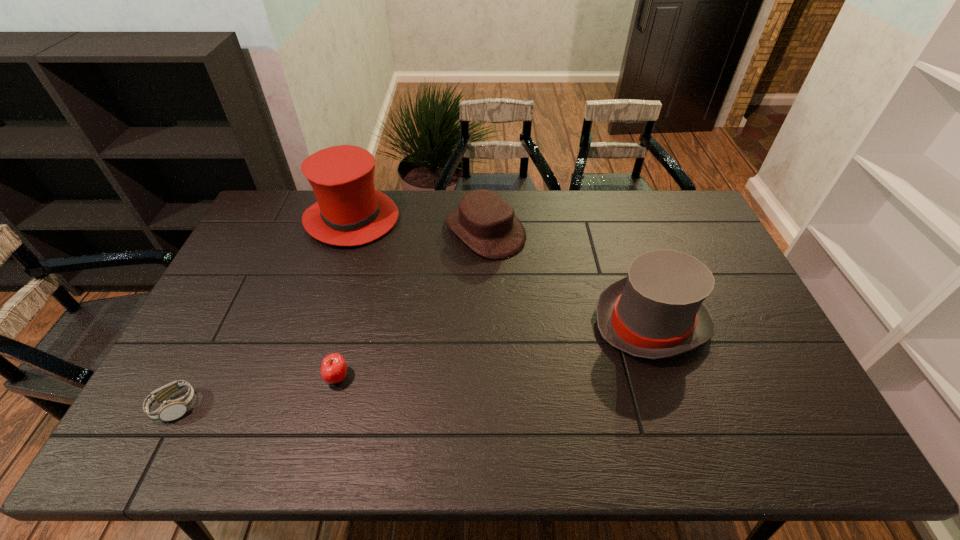
I want to click on the leftmost hat, so click(349, 211).

At what (x,y) coordinates should I click in order to perform the action: click on the tallest hat. Please return your answer as a coordinate pair (x, y). Looking at the image, I should click on (349, 211).

Identify the location of the rightmost hat. The height and width of the screenshot is (540, 960). (657, 311).

This screenshot has width=960, height=540. I want to click on the rightmost object, so click(x=657, y=311).

Identify the location of the third tallest object. (485, 222).

Where is `the shortest hat`? This screenshot has height=540, width=960. the shortest hat is located at coordinates (485, 222).

Image resolution: width=960 pixels, height=540 pixels. I want to click on apple, so click(x=333, y=369).

Locate an element on the screen. Image resolution: width=960 pixels, height=540 pixels. the shortest object is located at coordinates (170, 410).

Where is `the leftmost object`? This screenshot has width=960, height=540. the leftmost object is located at coordinates (170, 410).

The width and height of the screenshot is (960, 540). Identify the location of free region located 0.130m on the front of the tallest object. (333, 279).